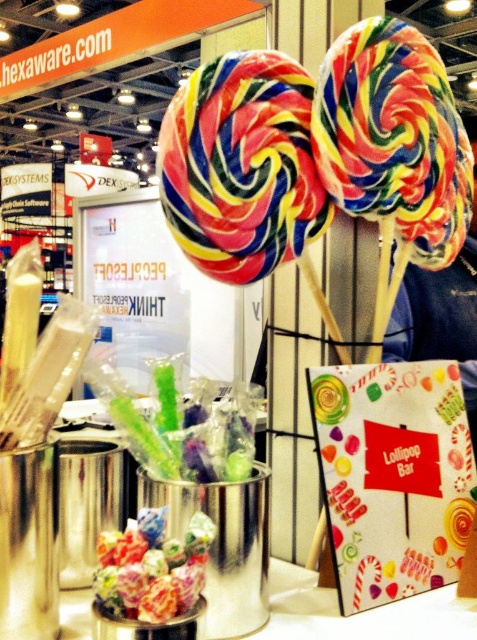
Who is taller, multicolored spiral lollipop at center or swirled sugar lollipop at center?

Standing taller between the two is swirled sugar lollipop at center.

Locate an element on the screen. Image resolution: width=477 pixels, height=640 pixels. multicolored spiral lollipop at center is located at coordinates (241, 166).

Between swirled sugar lollipop at center and translucent plastic lollipops at center, which one appears on the left side from the viewer's perspective?

translucent plastic lollipops at center

Does swirled sugar lollipop at center have a smaller size compared to translucent plastic lollipops at center?

Actually, swirled sugar lollipop at center might be larger than translucent plastic lollipops at center.

Between point (416, 45) and point (113, 548), which one is positioned in front?

Positioned in front is point (113, 548).

The width and height of the screenshot is (477, 640). Identify the location of swirled sugar lollipop at center. (394, 138).

Who is lower down, multicolored spiral lollipop at center or translucent plastic lollipops at center?

Positioned lower is translucent plastic lollipops at center.

In order to click on multicolored spiral lollipop at center in this screenshot , I will do pos(241,166).

Is point (207, 221) positioned after point (165, 518)?

Yes, point (207, 221) is farther from viewer.

Locate an element on the screen. The image size is (477, 640). multicolored spiral lollipop at center is located at coordinates (241, 166).